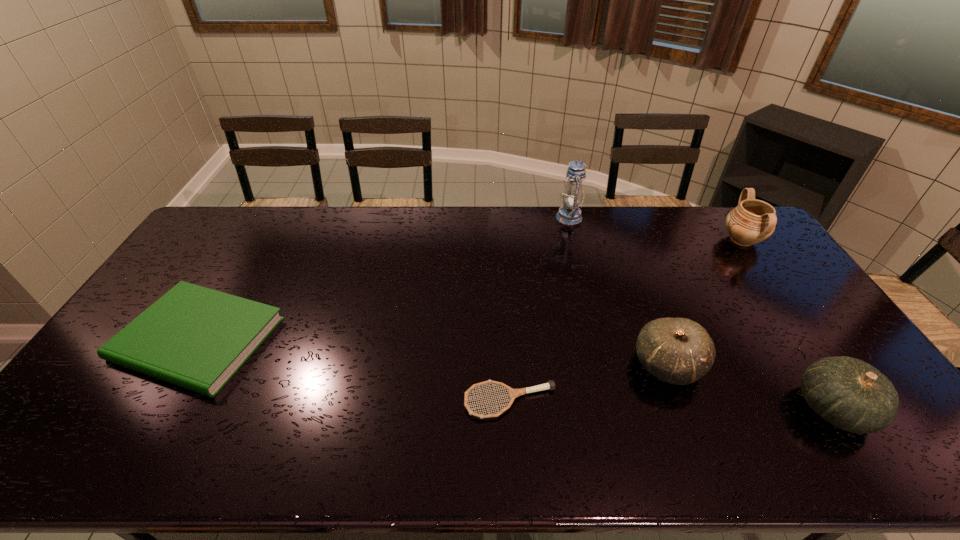
Find the location of a particular element. Image resolution: width=960 pixels, height=540 pixels. lantern is located at coordinates (570, 214).

Locate an element on the screen. the tallest object is located at coordinates (570, 214).

At what (x,y) coordinates should I click in order to perform the action: click on urn. Please return your answer as a coordinate pair (x, y). Image resolution: width=960 pixels, height=540 pixels. Looking at the image, I should click on pos(752,221).

I want to click on the right gourd, so click(x=850, y=394).

This screenshot has height=540, width=960. I want to click on the left gourd, so click(x=679, y=351).

Identify the location of the second shortest object. (197, 338).

You are a GUI agent. You are given a task and a screenshot of the screen. Output one action in this format:
    pyautogui.click(x=<x>, y=<y>)
    Task: Click on the leftmost object
    
    Given the screenshot: What is the action you would take?
    pyautogui.click(x=197, y=338)

Find the location of a particular element. Image resolution: width=960 pixels, height=540 pixels. tennis racket is located at coordinates (513, 393).

Locate an element on the screen. This screenshot has height=540, width=960. the fifth object from right to left is located at coordinates (513, 393).

At what (x,y) coordinates should I click in order to perform the action: click on vacant space located 0.190m on the front-facing side of the lantern. Please return your answer as a coordinate pair (x, y). Looking at the image, I should click on (507, 217).